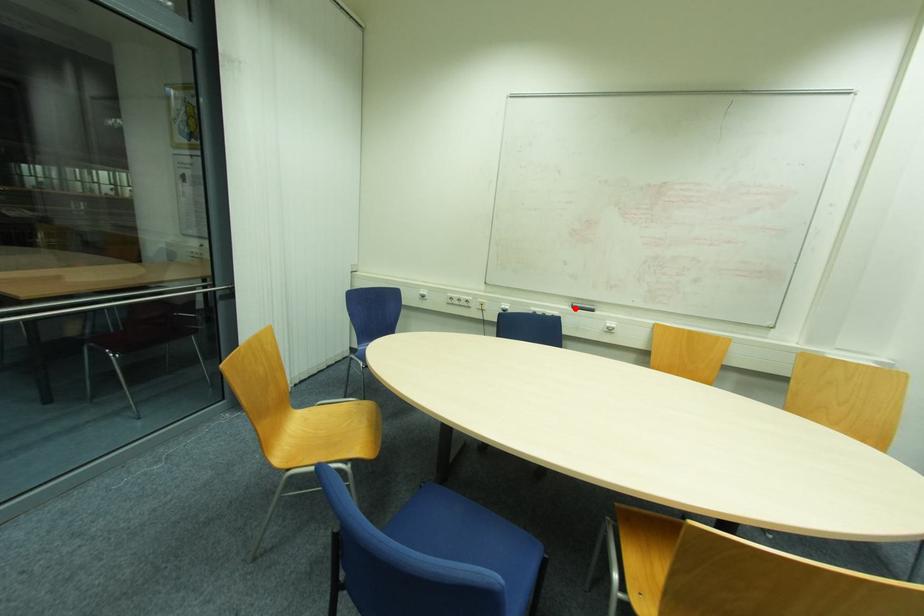
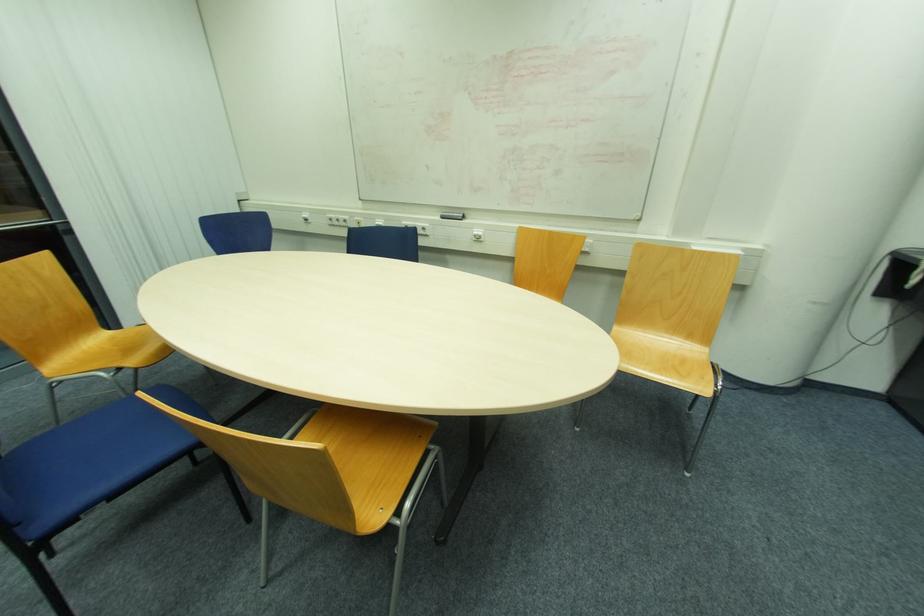
The point at the highlighted location is marked in the first image. Where is the corresponding point in the second image?

(444, 217)